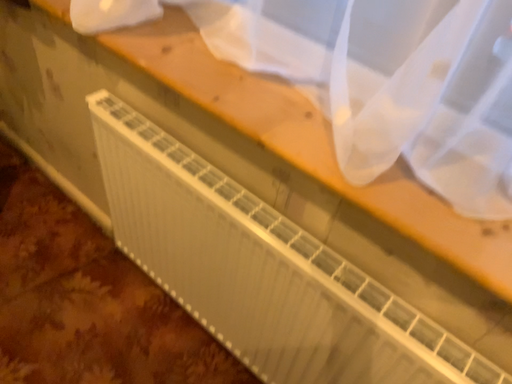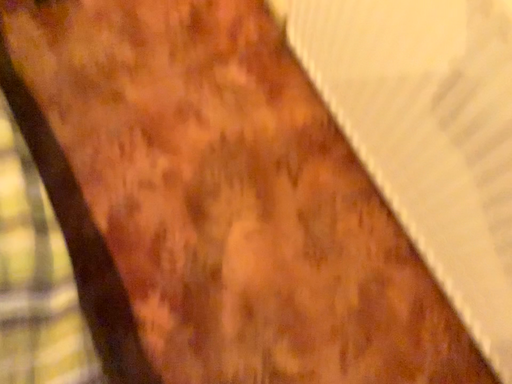
Question: Which way did the camera rotate in the video?

Choices:
 (A) rotated downward
 (B) rotated upward

Answer: (A)